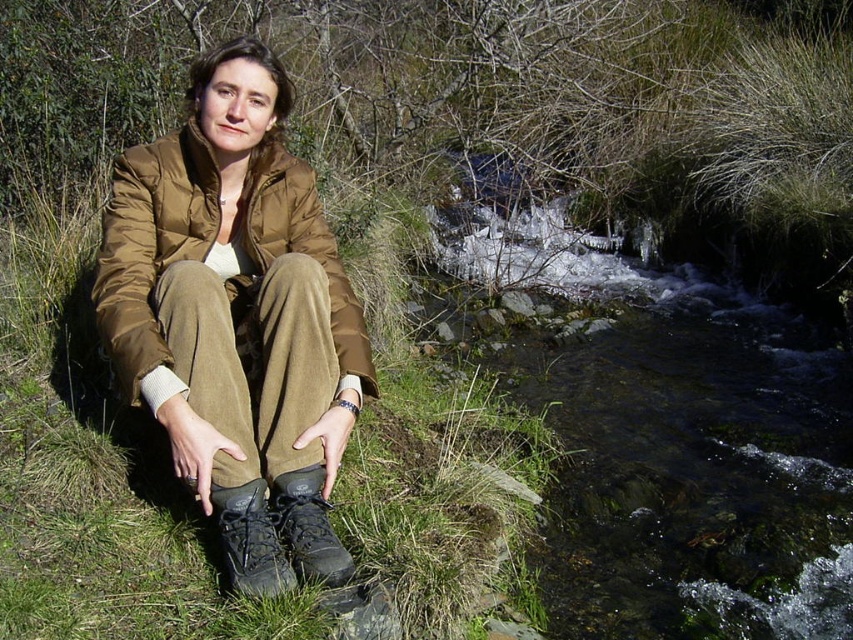
Between point (276, 561) and point (311, 520), which one is positioned in front?

Point (276, 561) is in front.

Is point (213, 488) positioned before point (334, 570)?

No, it is not.

You are a GUI agent. You are given a task and a screenshot of the screen. Output one action in this format:
    pyautogui.click(x=<x>, y=<y>)
    Task: Click on the leather boot at lower center
    
    Given the screenshot: What is the action you would take?
    pyautogui.click(x=250, y=540)

This screenshot has width=853, height=640. Describe the element at coordinates (236, 320) in the screenshot. I see `matte brown jacket at center` at that location.

Who is taller, matte brown jacket at center or dark grey leather boot at lower center?

Standing taller between the two is matte brown jacket at center.

Which is in front, point (267, 380) or point (293, 500)?

Point (293, 500) is more forward.

The image size is (853, 640). I want to click on matte brown jacket at center, so click(236, 320).

Does matte brown jacket at center have a lesser height compared to khaki corduroy pants at center?

In fact, matte brown jacket at center may be taller than khaki corduroy pants at center.

Does matte brown jacket at center have a larger size compared to khaki corduroy pants at center?

Correct, matte brown jacket at center is larger in size than khaki corduroy pants at center.

Between point (271, 298) and point (262, 314), which one is positioned behind?

The point (262, 314) is behind.

Find the location of a particular element. matte brown jacket at center is located at coordinates 236,320.